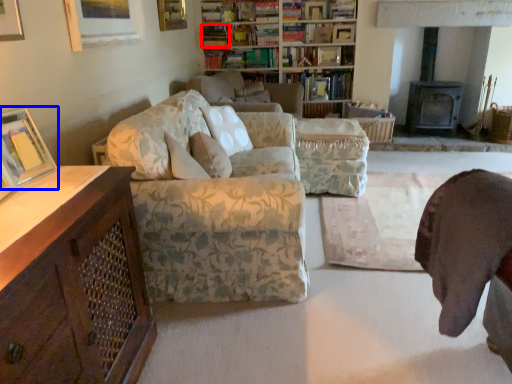
Question: Which object appears closest to the camera in this image, book (highlighted by a red box) or picture frame (highlighted by a blue box)?

Choices:
 (A) book
 (B) picture frame

Answer: (B)